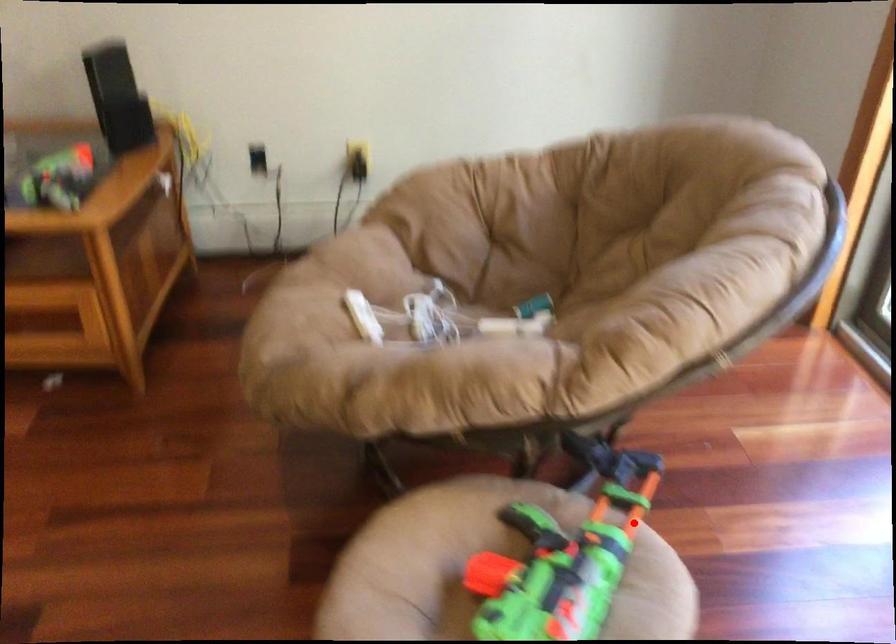
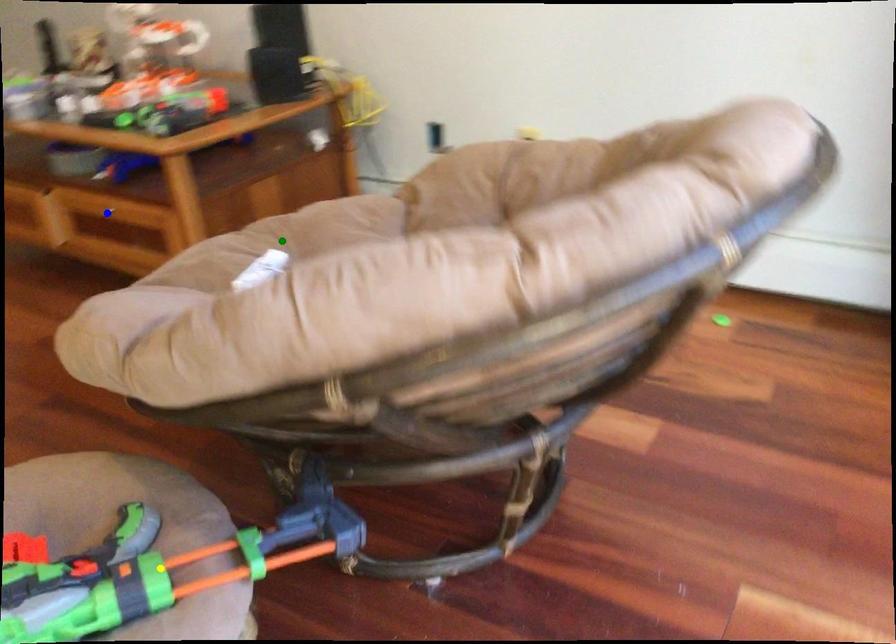
Question: I am providing you with two images of the same scene from different viewpoints. A red point is marked on the first image. You are given multiple points on the second image. Which point in image 2 represents the same 3d spot as the red point in image 1?

Choices:
 (A) yellow point
 (B) blue point
 (C) green point

Answer: (A)